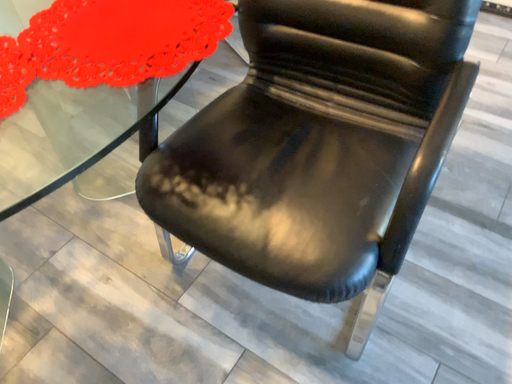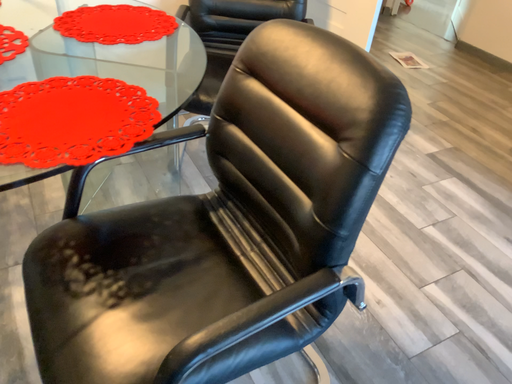
Question: How did the camera likely rotate when shooting the video?

Choices:
 (A) rotated left
 (B) rotated right

Answer: (A)